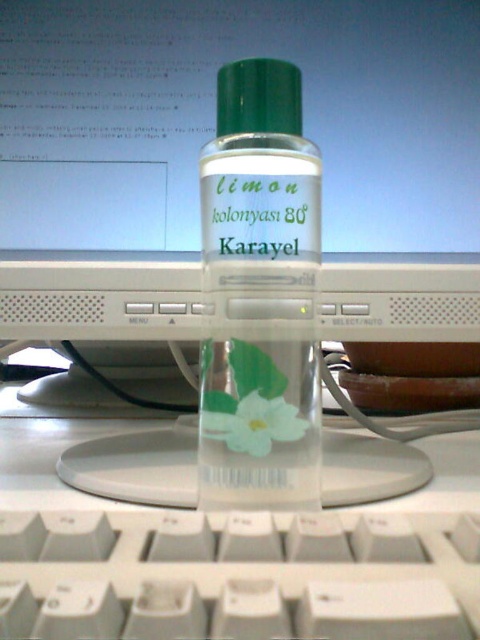
Is point (375, 636) farther from viewer compared to point (214, 422)?

No, it is in front of (214, 422).

Can you confirm if white plastic keyboard at bottom is positioned above white paper flower at center?

Actually, white plastic keyboard at bottom is below white paper flower at center.

Who is more distant from viewer, (385, 545) or (241, 451)?

The point (241, 451) is more distant.

Where is `white plastic keyboard at bottom`? The height and width of the screenshot is (640, 480). white plastic keyboard at bottom is located at coordinates (239, 573).

Is transparent plastic bottle at center further to camera compared to white paper flower at center?

No, transparent plastic bottle at center is closer to the viewer.

Who is positioned more to the left, transparent plastic bottle at center or white paper flower at center?

Positioned to the left is white paper flower at center.

In order to click on transparent plastic bottle at center in this screenshot , I will do `click(260, 294)`.

Is white plastic keyboard at bottom further to the viewer compared to transparent plastic bottle at center?

No.

Who is taller, white plastic keyboard at bottom or transparent plastic bottle at center?

Standing taller between the two is transparent plastic bottle at center.

The width and height of the screenshot is (480, 640). What do you see at coordinates (239, 573) in the screenshot?
I see `white plastic keyboard at bottom` at bounding box center [239, 573].

Identify the location of white plastic keyboard at bottom. (239, 573).